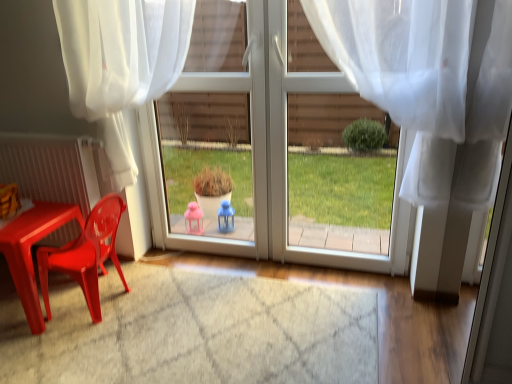
Question: Considering the relative positions of white sheer curtain at upper left, which ranks as the 2th curtain in right-to-left order, and matte plastic table at lower left in the image provided, is white sheer curtain at upper left, which ranks as the 2th curtain in right-to-left order, behind matte plastic table at lower left?

Choices:
 (A) yes
 (B) no

Answer: (B)

Question: Is white sheer curtain at upper left, which is counted as the 1th curtain, starting from the left, located outside matte plastic table at lower left?

Choices:
 (A) yes
 (B) no

Answer: (A)

Question: Would you say white sheer curtain at upper left, which is counted as the 1th curtain, starting from the left, contains matte plastic table at lower left?

Choices:
 (A) yes
 (B) no

Answer: (B)

Question: Considering the relative sizes of white sheer curtain at upper left, which ranks as the 2th curtain in right-to-left order, and matte plastic table at lower left in the image provided, is white sheer curtain at upper left, which ranks as the 2th curtain in right-to-left order, shorter than matte plastic table at lower left?

Choices:
 (A) no
 (B) yes

Answer: (A)

Question: Can you confirm if white sheer curtain at upper left, which is counted as the 1th curtain, starting from the left, is taller than matte plastic table at lower left?

Choices:
 (A) no
 (B) yes

Answer: (B)

Question: Is translucent white curtain at center, positioned as the 1th curtain in right-to-left order, inside or outside of matte plastic table at lower left?

Choices:
 (A) inside
 (B) outside

Answer: (B)

Question: In terms of size, does translucent white curtain at center, marked as the 2th curtain in a left-to-right arrangement, appear bigger or smaller than matte plastic table at lower left?

Choices:
 (A) small
 (B) big

Answer: (B)

Question: Would you say translucent white curtain at center, positioned as the 1th curtain in right-to-left order, is to the left or to the right of matte plastic table at lower left in the picture?

Choices:
 (A) left
 (B) right

Answer: (B)

Question: Considering the positions of translucent white curtain at center, positioned as the 1th curtain in right-to-left order, and matte plastic table at lower left in the image, is translucent white curtain at center, positioned as the 1th curtain in right-to-left order, wider or thinner than matte plastic table at lower left?

Choices:
 (A) thin
 (B) wide

Answer: (A)

Question: Is white glossy door at center inside or outside of translucent white curtain at center, marked as the 2th curtain in a left-to-right arrangement?

Choices:
 (A) inside
 (B) outside

Answer: (B)

Question: Based on their positions, is white glossy door at center located to the left or right of translucent white curtain at center, marked as the 2th curtain in a left-to-right arrangement?

Choices:
 (A) right
 (B) left

Answer: (B)

Question: From a real-world perspective, relative to translucent white curtain at center, positioned as the 1th curtain in right-to-left order, is white glossy door at center vertically above or below?

Choices:
 (A) above
 (B) below

Answer: (B)

Question: Is point (185, 79) closer or farther from the camera than point (367, 33)?

Choices:
 (A) closer
 (B) farther

Answer: (B)

Question: Considering the relative positions of matte plastic chair at left and white glossy door at center in the image provided, is matte plastic chair at left to the left or to the right of white glossy door at center?

Choices:
 (A) right
 (B) left

Answer: (B)

Question: Relative to white glossy door at center, is matte plastic chair at left in front or behind?

Choices:
 (A) behind
 (B) front

Answer: (B)